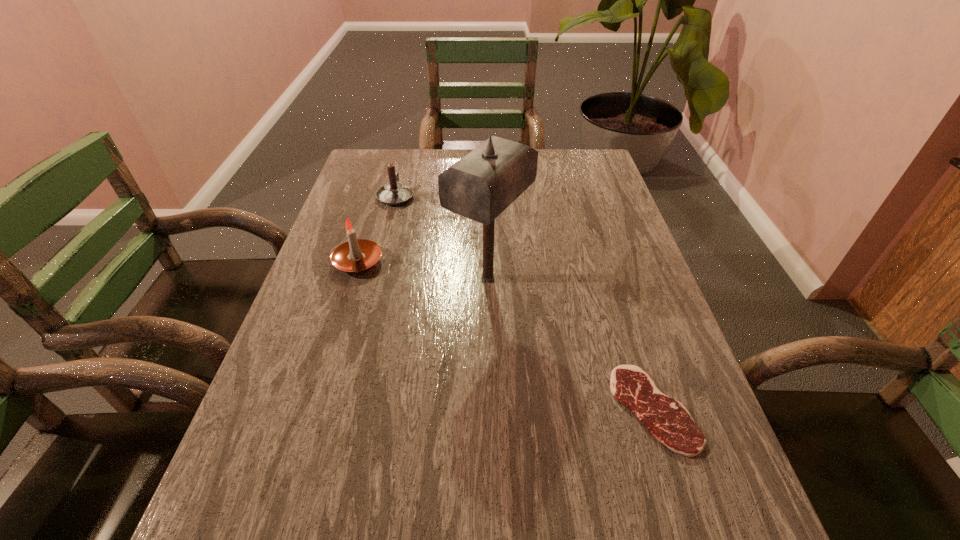
This screenshot has width=960, height=540. What are the coordinates of `vacant space at the near right corner of the desktop` in the screenshot? It's located at (698, 539).

Where is `unoccupied position between the mallet and the taller candle`? unoccupied position between the mallet and the taller candle is located at coordinates (423, 270).

Identify the location of blank region between the nearest object and the shorter candle. (524, 302).

Find the location of a particular element. This screenshot has width=960, height=540. empty space that is in between the second tallest object and the third object from left to right is located at coordinates [x=423, y=270].

Where is `vacant area that lies between the nearest object and the second object from right to left`? vacant area that lies between the nearest object and the second object from right to left is located at coordinates (571, 343).

I want to click on vacant point located between the shorter candle and the nearest object, so click(x=524, y=302).

Where is `vacant area between the nearer candle and the second shortest object`? The image size is (960, 540). vacant area between the nearer candle and the second shortest object is located at coordinates (377, 229).

Find the location of a particular element. unoccupied area between the shortest object and the mallet is located at coordinates (571, 343).

Where is `vacant area that lies between the taller candle and the shortest object`? Image resolution: width=960 pixels, height=540 pixels. vacant area that lies between the taller candle and the shortest object is located at coordinates (506, 335).

This screenshot has height=540, width=960. Find the location of `unoccupied position between the steak and the taller candle`. unoccupied position between the steak and the taller candle is located at coordinates (506, 335).